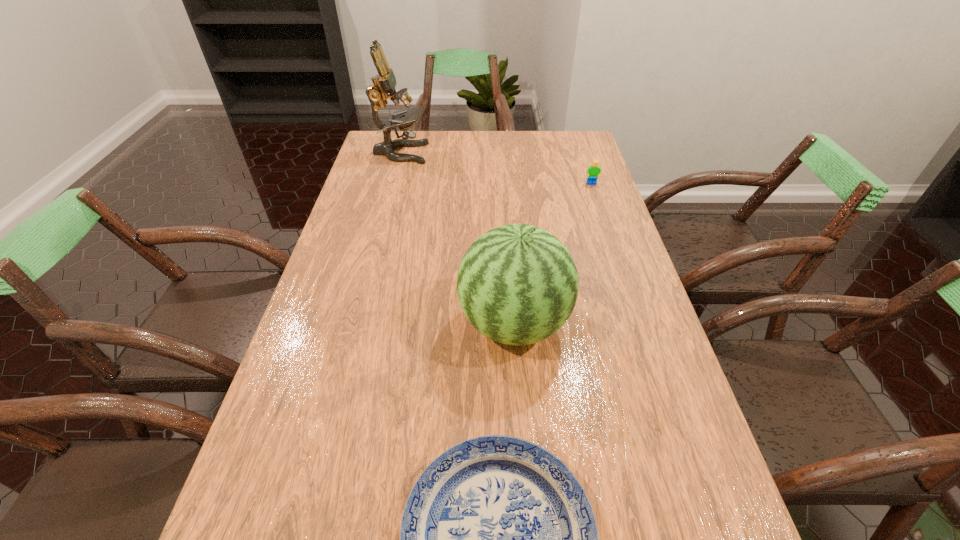
The height and width of the screenshot is (540, 960). Identify the location of object that is positioned at the left edge. (384, 83).

The width and height of the screenshot is (960, 540). In order to click on object present at the right edge in this screenshot , I will do `click(593, 171)`.

Image resolution: width=960 pixels, height=540 pixels. Identify the location of object present at the far left corner. (384, 83).

The height and width of the screenshot is (540, 960). In the image, there is a desktop. In order to click on free region at the far edge in this screenshot , I will do `click(531, 154)`.

This screenshot has width=960, height=540. What are the coordinates of `free region at the left edge` in the screenshot? It's located at (366, 332).

You are a GUI agent. You are given a task and a screenshot of the screen. Output one action in this format:
    pyautogui.click(x=<x>, y=<y>)
    Task: Click on the free space at the right edge of the desktop
    
    Given the screenshot: What is the action you would take?
    pyautogui.click(x=644, y=295)

This screenshot has width=960, height=540. Find the location of `free space between the Lego and the tallest object`. free space between the Lego and the tallest object is located at coordinates (496, 168).

This screenshot has height=540, width=960. I want to click on free spot between the third nearest object and the microscope, so click(x=496, y=168).

At what (x,y) coordinates should I click in order to perform the action: click on unoccupied position between the microscope and the second tallest object. Please return your answer as a coordinate pair (x, y). Looking at the image, I should click on (457, 238).

The width and height of the screenshot is (960, 540). What are the coordinates of `vacant space in between the second tallest object and the farthest object` in the screenshot? It's located at (457, 238).